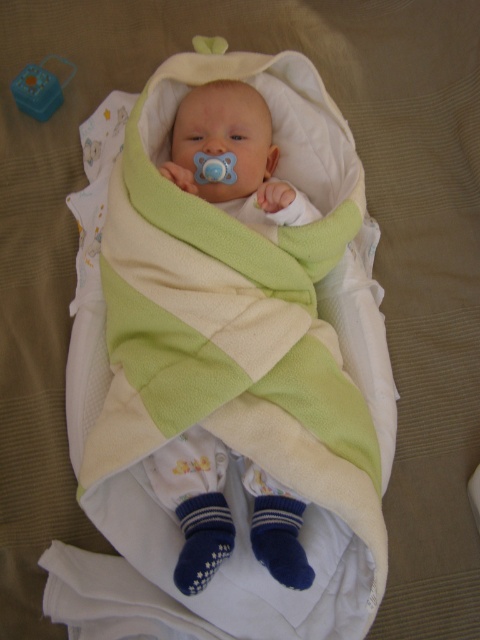
From the picture: Does soft fleece baby at center appear over blue plastic toy at upper left?

No, soft fleece baby at center is not above blue plastic toy at upper left.

This screenshot has height=640, width=480. I want to click on soft fleece baby at center, so click(x=204, y=336).

Between blue plastic toy at upper left and blue rubber pacifier at center, which one appears on the right side from the viewer's perspective?

blue rubber pacifier at center

Image resolution: width=480 pixels, height=640 pixels. What do you see at coordinates (39, 88) in the screenshot?
I see `blue plastic toy at upper left` at bounding box center [39, 88].

Is point (41, 93) closer to camera compared to point (219, 156)?

No, (41, 93) is further to viewer.

Locate an element on the screen. The height and width of the screenshot is (640, 480). blue plastic toy at upper left is located at coordinates (39, 88).

Which is above, soft fleece baby at center or blue rubber pacifier at center?

Positioned higher is blue rubber pacifier at center.

From the picture: Does soft fleece baby at center appear on the right side of blue rubber pacifier at center?

Yes, soft fleece baby at center is to the right of blue rubber pacifier at center.

Does point (130, 419) come in front of point (226, 157)?

Yes.

Image resolution: width=480 pixels, height=640 pixels. I want to click on soft fleece baby at center, so click(x=204, y=336).